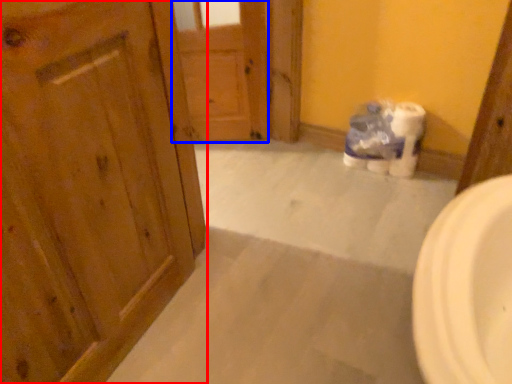
Question: Which point is further to the camera, door (highlighted by a red box) or door (highlighted by a blue box)?

Choices:
 (A) door
 (B) door

Answer: (B)